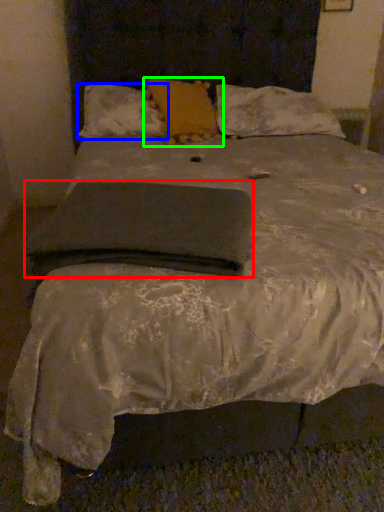
Question: Estimate the real-world distances between objects in this image. Which object is closer to pad (highlighted by a red box), pillow (highlighted by a blue box) or pillow (highlighted by a green box)?

Choices:
 (A) pillow
 (B) pillow

Answer: (B)